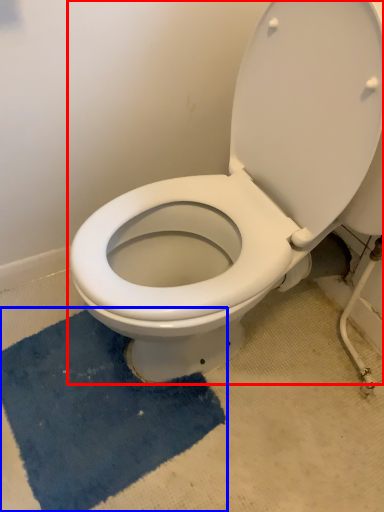
Question: Among these objects, which one is farthest to the camera, toilet (highlighted by a red box) or bath mat (highlighted by a blue box)?

Choices:
 (A) toilet
 (B) bath mat

Answer: (B)